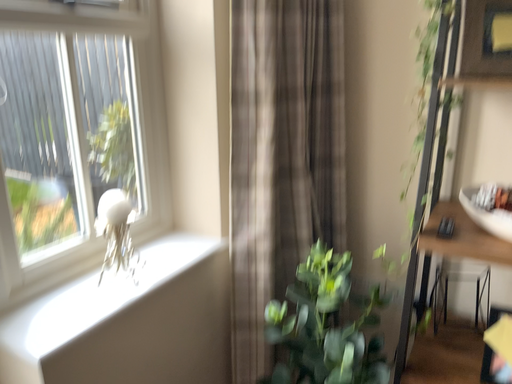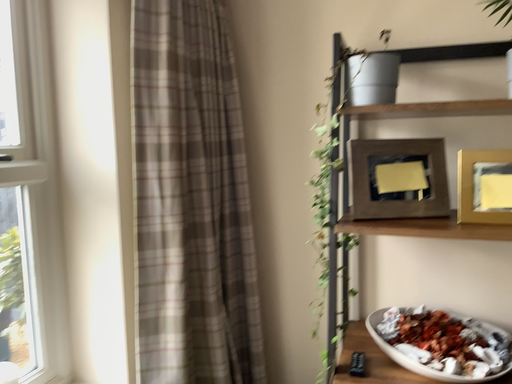
Question: How did the camera likely rotate when shooting the video?

Choices:
 (A) rotated right
 (B) rotated left

Answer: (A)